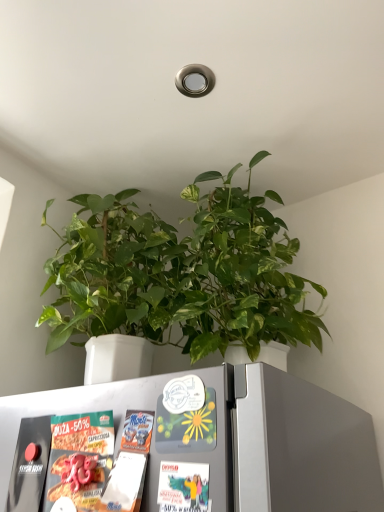
The height and width of the screenshot is (512, 384). I want to click on empty space that is ontop of green matte plant at center (from a real-world perspective), so click(184, 163).